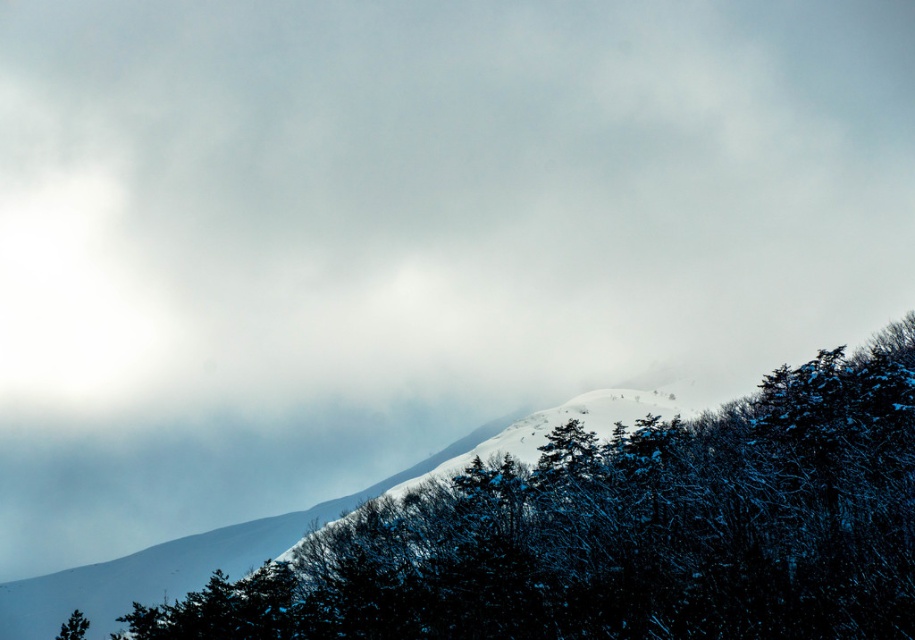
You are a hiker planning to cross the mountain. You see the snowy evergreen trees at center and the green matte tree at lower left. Which tree is closer to the mountain peak?

The snowy evergreen trees at center are positioned over the green matte tree at lower left, meaning they are closer to the mountain peak.

You are an artist planning to paint this winter scene. You want to ensure the snowy evergreen trees at center and the green matte tree at lower left are proportionally accurate. Which tree should you make wider in your painting?

The green matte tree at lower left should be wider in the painting because the snowy evergreen trees at center are narrower than the green matte tree at lower left according to the description.